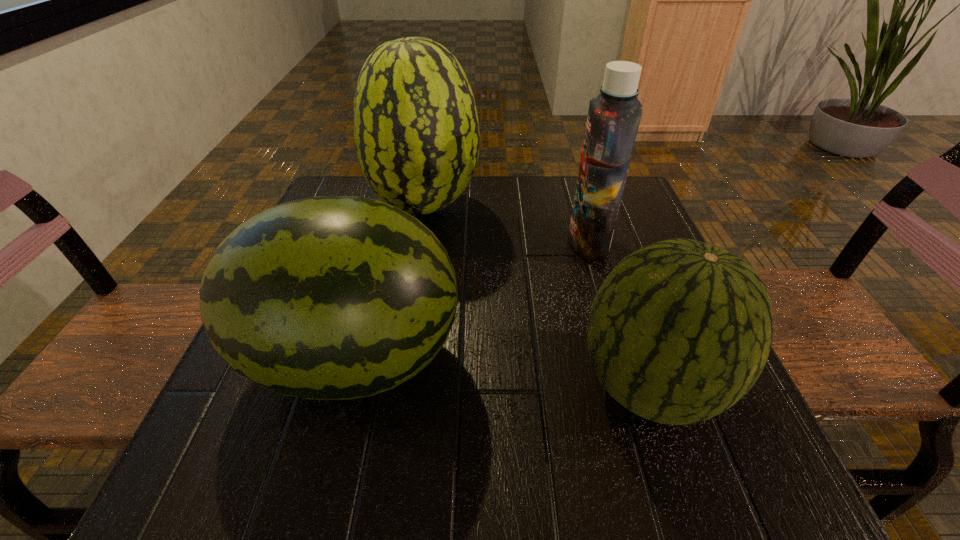
Where is `shampoo that is positioned at the right edge`? shampoo that is positioned at the right edge is located at coordinates (613, 120).

At what (x,y) coordinates should I click in order to perform the action: click on watermelon present at the right edge. Please return your answer as a coordinate pair (x, y). The width and height of the screenshot is (960, 540). Looking at the image, I should click on (680, 330).

Where is `object present at the far left corner`? The width and height of the screenshot is (960, 540). object present at the far left corner is located at coordinates (416, 130).

At what (x,y) coordinates should I click in order to perform the action: click on object that is at the near left corner. Please return your answer as a coordinate pair (x, y). The width and height of the screenshot is (960, 540). Looking at the image, I should click on (330, 297).

Where is `object present at the far right corner`? object present at the far right corner is located at coordinates (613, 120).

Locate an element on the screen. The width and height of the screenshot is (960, 540). object present at the near right corner is located at coordinates (680, 330).

In the image, there is a desktop. Where is `free region at the far edge`? free region at the far edge is located at coordinates (521, 218).

In the image, there is a desktop. In order to click on free space at the near edge in this screenshot , I will do `click(506, 476)`.

You are a GUI agent. You are given a task and a screenshot of the screen. Output one action in this format:
    pyautogui.click(x=<x>, y=<y>)
    Task: Click on the free space at the left edge of the desktop
    Image resolution: width=960 pixels, height=540 pixels.
    Given the screenshot: What is the action you would take?
    pyautogui.click(x=287, y=424)

Image resolution: width=960 pixels, height=540 pixels. In the image, there is a desktop. In order to click on vacant space at the near right corner in this screenshot , I will do `click(700, 494)`.